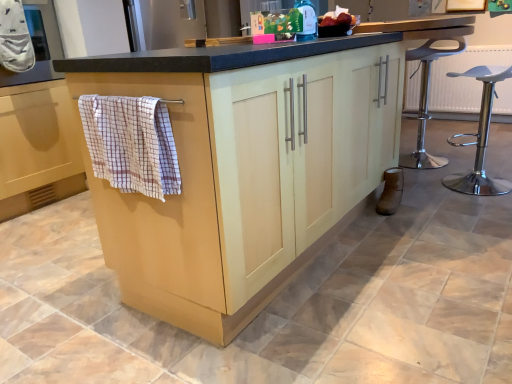
Question: Can you confirm if brown suede boot at lower right is shorter than checkered fabric bath towel at left, arranged as the 1th bath towel when viewed from the front?

Choices:
 (A) yes
 (B) no

Answer: (A)

Question: Considering the relative positions of brown suede boot at lower right and checkered fabric bath towel at left, the 2th bath towel in the back-to-front sequence, in the image provided, is brown suede boot at lower right to the left of checkered fabric bath towel at left, the 2th bath towel in the back-to-front sequence, from the viewer's perspective?

Choices:
 (A) yes
 (B) no

Answer: (B)

Question: Is brown suede boot at lower right wider than checkered fabric bath towel at left, the 2th bath towel in the back-to-front sequence?

Choices:
 (A) yes
 (B) no

Answer: (B)

Question: Is brown suede boot at lower right oriented towards checkered fabric bath towel at left, marked as the second bath towel in a top-to-bottom arrangement?

Choices:
 (A) no
 (B) yes

Answer: (A)

Question: Can we say brown suede boot at lower right lies outside checkered fabric bath towel at left, acting as the 2th bath towel starting from the left?

Choices:
 (A) yes
 (B) no

Answer: (A)

Question: Can you confirm if brown suede boot at lower right is positioned to the right of checkered fabric bath towel at left, the 1th bath towel when ordered from right to left?

Choices:
 (A) yes
 (B) no

Answer: (A)

Question: Is there a large distance between brown suede boot at lower right and white plastic stool at right?

Choices:
 (A) no
 (B) yes

Answer: (A)

Question: From a real-world perspective, is brown suede boot at lower right positioned under white plastic stool at right based on gravity?

Choices:
 (A) yes
 (B) no

Answer: (A)

Question: Does brown suede boot at lower right appear on the right side of white plastic stool at right?

Choices:
 (A) no
 (B) yes

Answer: (A)

Question: From a real-world perspective, does brown suede boot at lower right stand above white plastic stool at right?

Choices:
 (A) yes
 (B) no

Answer: (B)

Question: Can you see brown suede boot at lower right touching white plastic stool at right?

Choices:
 (A) yes
 (B) no

Answer: (B)

Question: Can you confirm if brown suede boot at lower right is taller than white plastic stool at right?

Choices:
 (A) yes
 (B) no

Answer: (B)

Question: Considering the relative sizes of matte gray oven at upper left and brown suede boot at lower right in the image provided, is matte gray oven at upper left taller than brown suede boot at lower right?

Choices:
 (A) no
 (B) yes

Answer: (B)